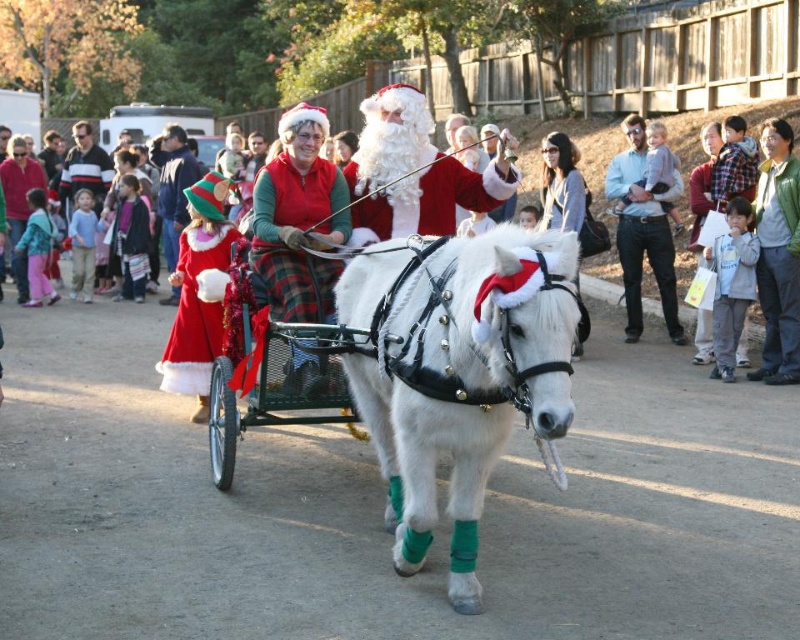
You are a photographer trying to capture the festive scene. You notice the white fluffy beard at center and the striped sweater at center. Which one is shorter in height?

The white fluffy beard at center has a lesser height compared to the striped sweater at center.

You are a photographer trying to capture a closeup of the white fluffy beard at center and the gray fleece jacket at lower right. Since you want both subjects to be clearly visible, which one should you zoom in on less to avoid cropping?

The white fluffy beard at center is wider than the gray fleece jacket at lower right. To ensure both are visible without cropping, you should zoom in less on the white fluffy beard at center so its larger size fits within the frame.

Based on the photo, you are a photographer standing at the edge of the road where the pony and carriage are passing by. You want to take a photo of both the white fluffy beard at center and the striped sweater at center in the same frame. Your camera has a maximum focus range of 30 feet. Will you be able to capture both subjects in focus?

The distance between the white fluffy beard at center and the striped sweater at center is 33.21 feet, which exceeds the camera maximum focus range of 30 feet. Therefore, you cannot capture both subjects in focus.